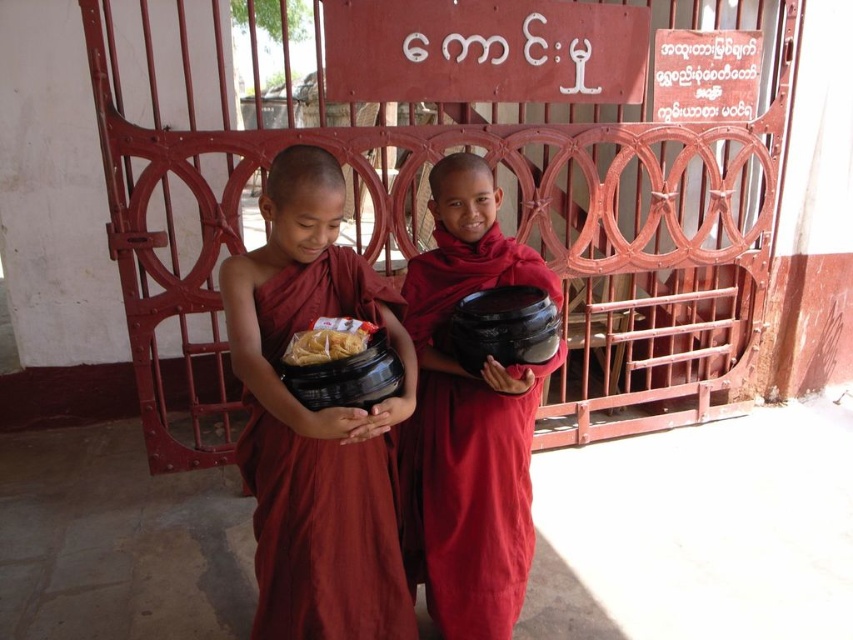
Question: From the image, what is the correct spatial relationship of matte red robe at center in relation to yellowish matte noodles at center?

Choices:
 (A) right
 (B) left

Answer: (B)

Question: Does matte red robe at center appear over matte black bowl at center?

Choices:
 (A) no
 (B) yes

Answer: (A)

Question: Which point appears closest to the camera in this image?

Choices:
 (A) (444, 545)
 (B) (376, 538)

Answer: (B)

Question: Among these objects, which one is nearest to the camera?

Choices:
 (A) yellowish matte noodles at center
 (B) matte black bowl at center

Answer: (A)

Question: Which object appears closest to the camera in this image?

Choices:
 (A) matte red robe at center
 (B) yellowish matte noodles at center

Answer: (A)

Question: Is matte black bowl at center bigger than yellowish matte noodles at center?

Choices:
 (A) yes
 (B) no

Answer: (A)